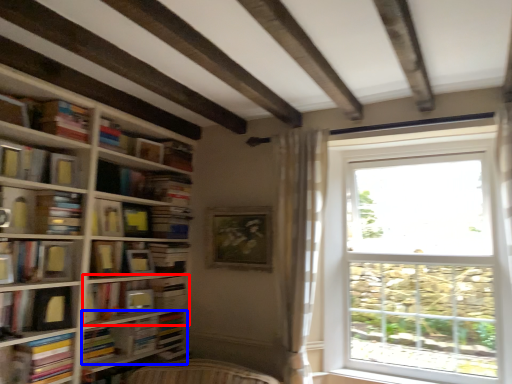
Question: Which object is further to the camera taking this photo, shelf (highlighted by a red box) or book (highlighted by a blue box)?

Choices:
 (A) shelf
 (B) book

Answer: (A)